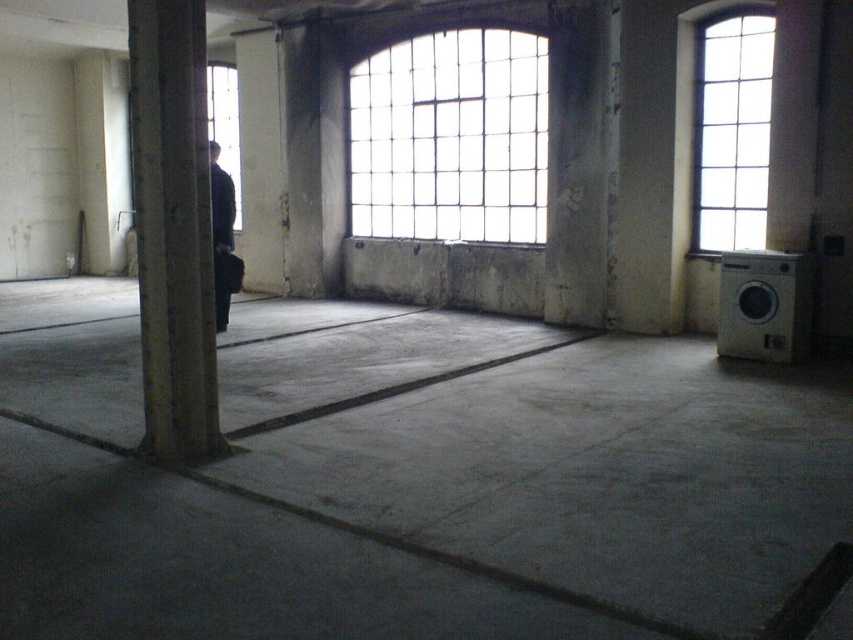
Who is more forward, (734, 22) or (215, 292)?

Point (215, 292) is in front.

What do you see at coordinates (732, 132) in the screenshot?
I see `clear glass window at upper right` at bounding box center [732, 132].

Is point (746, 138) farther from camera compared to point (212, 189)?

Yes, it is.

The image size is (853, 640). Find the location of `clear glass window at upper right`. clear glass window at upper right is located at coordinates (732, 132).

Does concrete at left have a greater width compared to clear glass window at upper right?

Correct, the width of concrete at left exceeds that of clear glass window at upper right.

Can you confirm if concrete at left is positioned to the right of clear glass window at upper right?

Incorrect, concrete at left is not on the right side of clear glass window at upper right.

Does point (161, 96) come behind point (730, 88)?

No, it is in front of (730, 88).

Locate an element on the screen. This screenshot has height=640, width=853. concrete at left is located at coordinates (173, 228).

Does clear glass window at center have a greater width compared to concrete at left?

Indeed, clear glass window at center has a greater width compared to concrete at left.

The height and width of the screenshot is (640, 853). What are the coordinates of `clear glass window at center` in the screenshot? It's located at pyautogui.click(x=451, y=138).